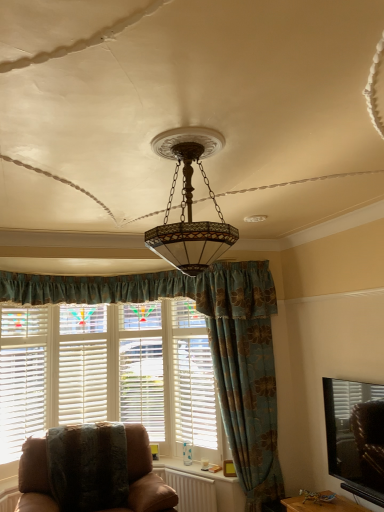
Question: Is matte glass chandelier at center facing towards brown leather chair at lower left?

Choices:
 (A) yes
 (B) no

Answer: (B)

Question: Considering the relative sizes of matte glass chandelier at center and brown leather chair at lower left in the image provided, is matte glass chandelier at center taller than brown leather chair at lower left?

Choices:
 (A) no
 (B) yes

Answer: (A)

Question: Is matte glass chandelier at center turned away from brown leather chair at lower left?

Choices:
 (A) no
 (B) yes

Answer: (A)

Question: Does matte glass chandelier at center have a larger size compared to brown leather chair at lower left?

Choices:
 (A) yes
 (B) no

Answer: (B)

Question: Does matte glass chandelier at center come in front of brown leather chair at lower left?

Choices:
 (A) no
 (B) yes

Answer: (B)

Question: Would you consider matte glass chandelier at center to be distant from brown leather chair at lower left?

Choices:
 (A) no
 (B) yes

Answer: (B)

Question: Would you say white wood window frame at center contains brown leather chair at lower left?

Choices:
 (A) no
 (B) yes

Answer: (A)

Question: Does white wood window frame at center have a greater width compared to brown leather chair at lower left?

Choices:
 (A) no
 (B) yes

Answer: (A)

Question: Can you confirm if white wood window frame at center is thinner than brown leather chair at lower left?

Choices:
 (A) no
 (B) yes

Answer: (B)

Question: Is white wood window frame at center positioned with its back to brown leather chair at lower left?

Choices:
 (A) no
 (B) yes

Answer: (A)

Question: Does white wood window frame at center have a larger size compared to brown leather chair at lower left?

Choices:
 (A) yes
 (B) no

Answer: (B)

Question: From a real-world perspective, is white wood window frame at center beneath brown leather chair at lower left?

Choices:
 (A) yes
 (B) no

Answer: (B)

Question: Considering the relative positions of blue floral fabric curtain at center and white plastic radiator at lower center in the image provided, is blue floral fabric curtain at center to the left of white plastic radiator at lower center from the viewer's perspective?

Choices:
 (A) yes
 (B) no

Answer: (B)